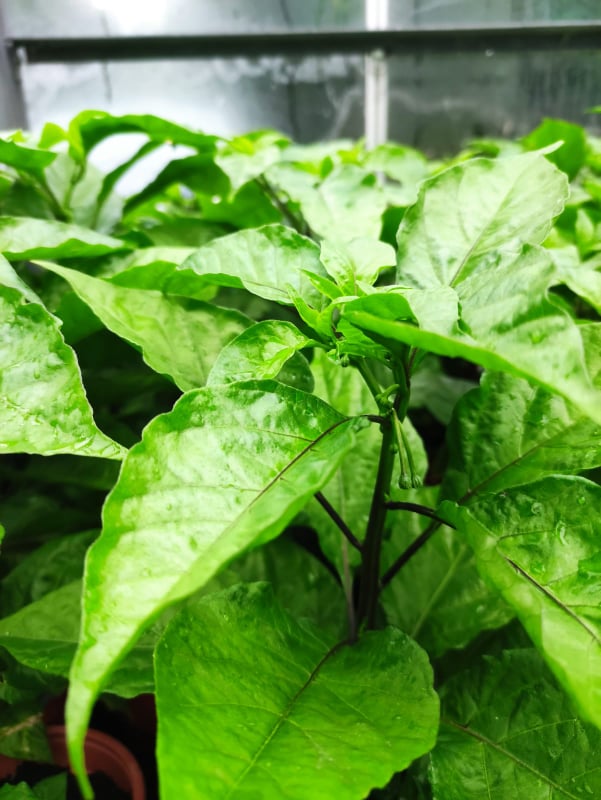
Identify the location of window glass. Image resolution: width=601 pixels, height=800 pixels. (237, 84), (445, 6).